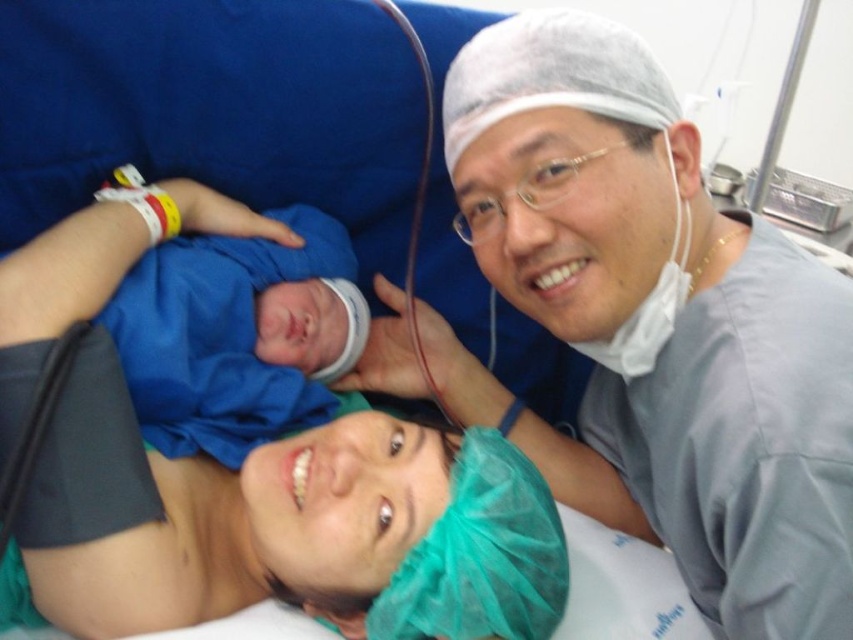
Question: Which point is closer to the camera?

Choices:
 (A) tap(239, 360)
 (B) tap(496, 49)

Answer: (B)

Question: Is gray scrubs at upper right further to the viewer compared to blue fabric swaddle at center?

Choices:
 (A) yes
 (B) no

Answer: (B)

Question: Does gray scrubs at upper right appear on the right side of blue fabric swaddle at center?

Choices:
 (A) yes
 (B) no

Answer: (A)

Question: Which point appears farthest from the camera in this image?

Choices:
 (A) (523, 180)
 (B) (120, 362)

Answer: (B)

Question: Does gray scrubs at upper right appear under blue fabric swaddle at center?

Choices:
 (A) yes
 (B) no

Answer: (A)